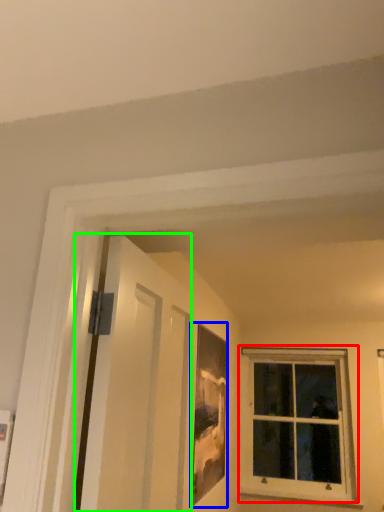
Question: Which is nearer to the window (highlighted by a red box)? picture frame (highlighted by a blue box) or screen door (highlighted by a green box).

Choices:
 (A) picture frame
 (B) screen door

Answer: (A)